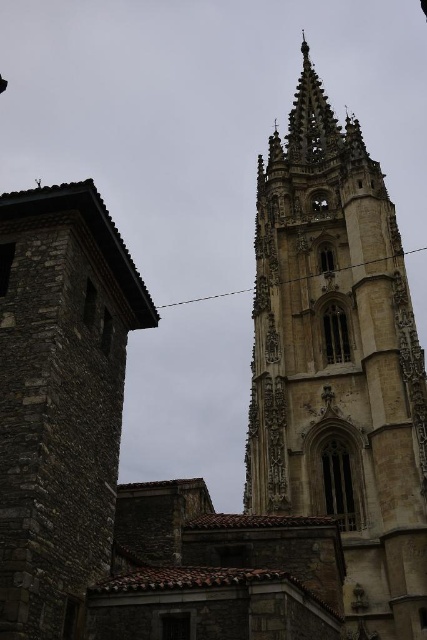
Question: Which point appears closest to the camera in this image?

Choices:
 (A) (278, 250)
 (B) (35, 340)

Answer: (B)

Question: Which object appears closest to the camera in this image?

Choices:
 (A) brown stone tower at upper right
 (B) stone tower at left

Answer: (B)

Question: Is brown stone tower at upper right further to camera compared to stone tower at left?

Choices:
 (A) no
 (B) yes

Answer: (B)

Question: Does brown stone tower at upper right come behind stone tower at left?

Choices:
 (A) yes
 (B) no

Answer: (A)

Question: From the image, what is the correct spatial relationship of brown stone tower at upper right in relation to stone tower at left?

Choices:
 (A) right
 (B) left

Answer: (A)